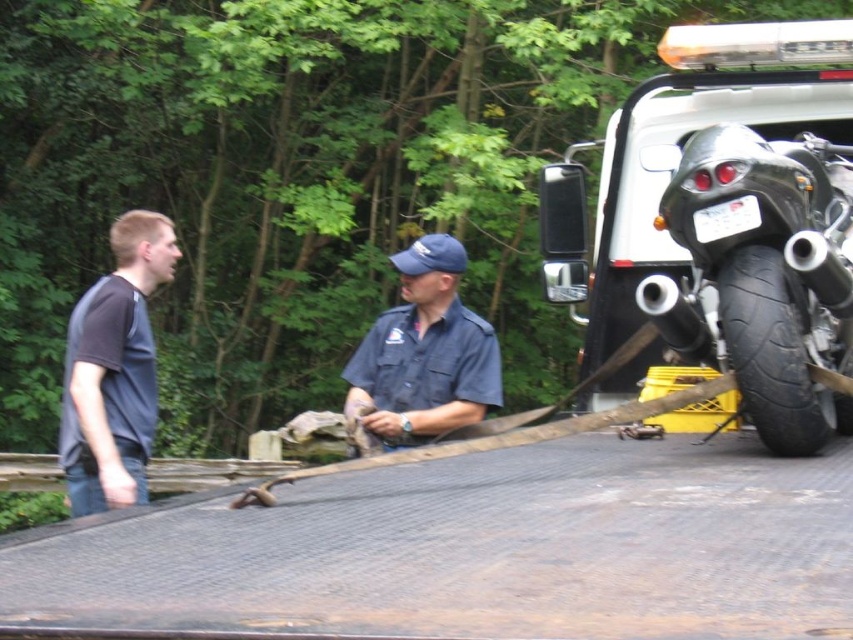
Question: Can you confirm if dark gray t-shirt at left is smaller than black rubber tire at right?

Choices:
 (A) yes
 (B) no

Answer: (B)

Question: Which point is farther from the camera taking this photo?

Choices:
 (A) (726, 177)
 (B) (755, 260)
 (C) (395, 346)
 (D) (70, 465)

Answer: (C)

Question: Can you confirm if dark gray t-shirt at left is thinner than black rubber tire at right?

Choices:
 (A) no
 (B) yes

Answer: (B)

Question: Which object is farther from the camera taking this photo?

Choices:
 (A) blue uniform shirt at center
 (B) shiny black motorcycle at right

Answer: (A)

Question: Estimate the real-world distances between objects in this image. Which object is farther from the black rubber tire at right?

Choices:
 (A) blue uniform shirt at center
 (B) dark gray t-shirt at left

Answer: (B)

Question: Does shiny black motorcycle at right have a larger size compared to blue uniform shirt at center?

Choices:
 (A) yes
 (B) no

Answer: (A)